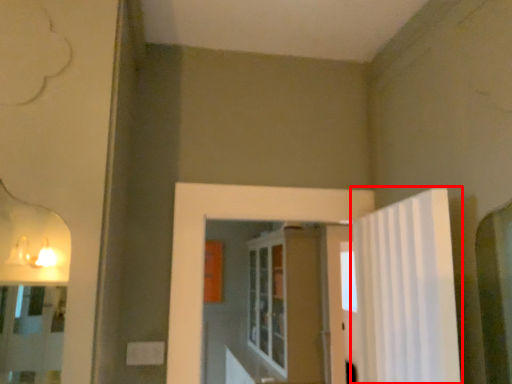
Question: From the image's perspective, considering the relative positions of shower curtain (annotated by the red box) and screen door in the image provided, where is shower curtain (annotated by the red box) located with respect to the staircase?

Choices:
 (A) above
 (B) below

Answer: (A)